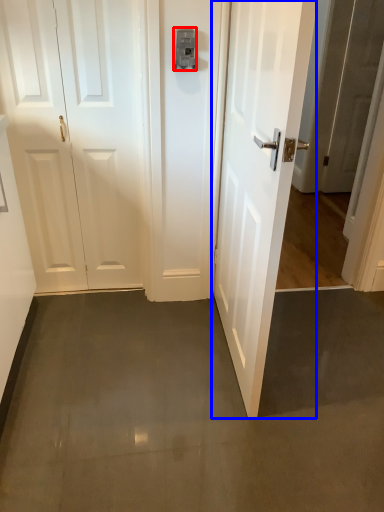
Question: Which point is further to the camera, latch (highlighted by a red box) or door (highlighted by a blue box)?

Choices:
 (A) latch
 (B) door

Answer: (A)